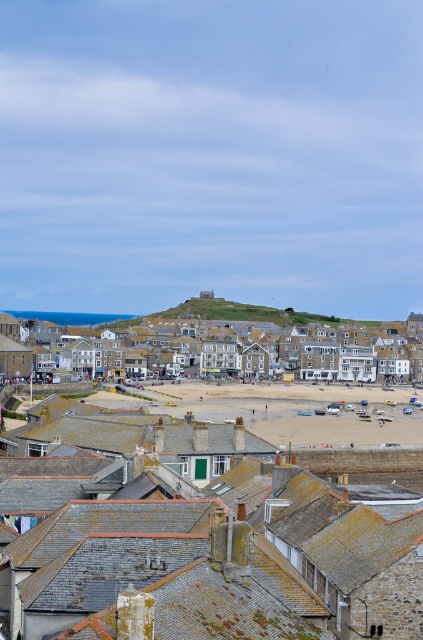
You are standing on the beige sand at center and want to walk to the beige stone buildings at center. Which direction should you walk?

You should walk to the left because the beige sand at center is on the right side of the beige stone buildings at center, so moving left would take you towards them.

You are a tourist standing on the beige sand at center. Looking around, you see the beige stone buildings at center. Which object is closer to you?

The beige sand at center is closer to you because it is positioned under the beige stone buildings at center, indicating it is lower in elevation.